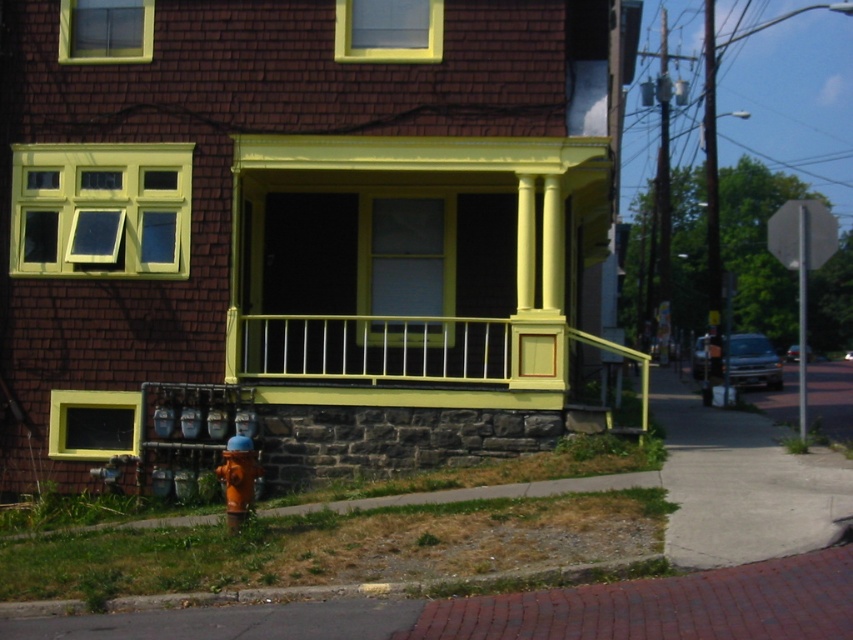
Who is shorter, brick pavement at lower right or orange matte hydrant at lower left?

Standing shorter between the two is brick pavement at lower right.

Which is in front, point (473, 625) or point (236, 436)?

Positioned in front is point (473, 625).

Between point (614, 611) and point (234, 525), which one is positioned in front?

Positioned in front is point (614, 611).

The width and height of the screenshot is (853, 640). Find the location of `brick pavement at lower right`. brick pavement at lower right is located at coordinates (526, 611).